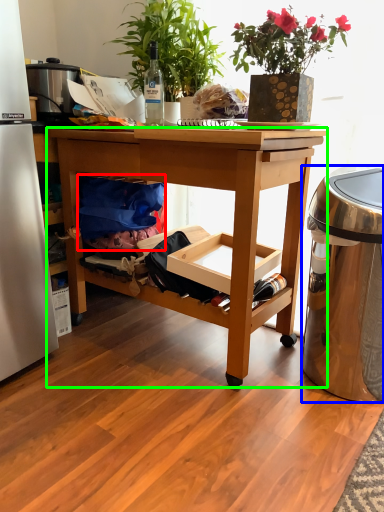
Question: Based on their relative distances, which object is nearer to material (highlighted by a red box)? Choose from trash bin/can (highlighted by a blue box) and desk (highlighted by a green box).

Choices:
 (A) trash bin/can
 (B) desk

Answer: (B)